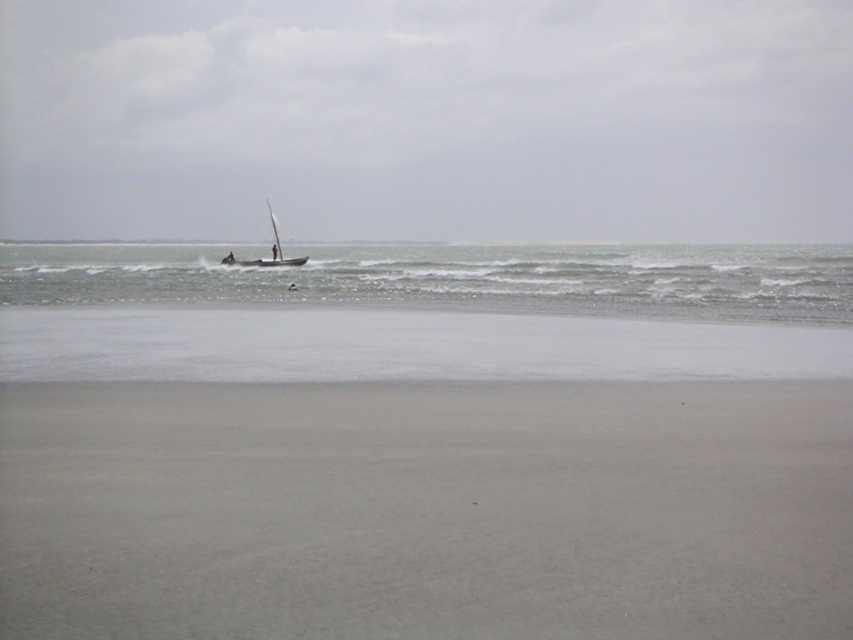
In the scene shown: Is smooth sand at lower center shorter than wooden sailboat at center?

Yes.

Describe the element at coordinates (426, 509) in the screenshot. Image resolution: width=853 pixels, height=640 pixels. I see `smooth sand at lower center` at that location.

Image resolution: width=853 pixels, height=640 pixels. I want to click on smooth sand at lower center, so click(x=426, y=509).

Who is shorter, smooth sand at lower center or clear water at center?

smooth sand at lower center

Between smooth sand at lower center and clear water at center, which one is positioned lower?

Positioned lower is smooth sand at lower center.

Is point (260, 445) farther from camera compared to point (20, 260)?

No, it is in front of (20, 260).

The image size is (853, 640). I want to click on smooth sand at lower center, so coord(426,509).

This screenshot has width=853, height=640. What do you see at coordinates (427, 120) in the screenshot?
I see `white matte sailboat at center` at bounding box center [427, 120].

Is white matte sailboat at center thinner than clear water at center?

Incorrect, white matte sailboat at center's width is not less than clear water at center's.

The width and height of the screenshot is (853, 640). Identify the location of white matte sailboat at center. (427, 120).

This screenshot has width=853, height=640. In order to click on white matte sailboat at center in this screenshot , I will do `click(427, 120)`.